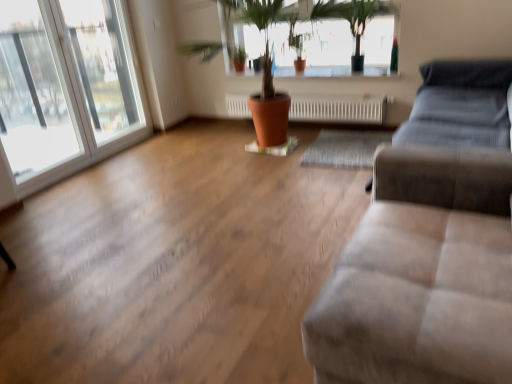
Question: Does transparent glass window at left, positioned as the second window in left-to-right order, come in front of transparent glass window at left, arranged as the 1th window when viewed from the left?

Choices:
 (A) yes
 (B) no

Answer: (B)

Question: Does transparent glass window at left, placed as the first window when sorted from right to left, have a greater height compared to transparent glass window at left, arranged as the 1th window when viewed from the left?

Choices:
 (A) yes
 (B) no

Answer: (B)

Question: Is transparent glass window at left, placed as the first window when sorted from right to left, not within transparent glass window at left, arranged as the 1th window when viewed from the left?

Choices:
 (A) yes
 (B) no

Answer: (B)

Question: Is transparent glass window at left, the 2th window viewed from the right, located within transparent glass window at left, placed as the first window when sorted from right to left?

Choices:
 (A) no
 (B) yes

Answer: (A)

Question: From the image's perspective, is transparent glass window at left, placed as the first window when sorted from right to left, on transparent glass window at left, the 2th window viewed from the right?

Choices:
 (A) no
 (B) yes

Answer: (B)

Question: Does point (56, 71) appear closer or farther from the camera than point (297, 57)?

Choices:
 (A) farther
 (B) closer

Answer: (B)

Question: Choose the correct answer: Is transparent glass window at left, arranged as the 1th window when viewed from the left, inside terracotta clay pot at center or outside it?

Choices:
 (A) inside
 (B) outside

Answer: (B)

Question: Visually, is transparent glass window at left, arranged as the 1th window when viewed from the left, positioned to the left or to the right of terracotta clay pot at center?

Choices:
 (A) right
 (B) left

Answer: (B)

Question: In terms of size, does transparent glass window at left, the 2th window viewed from the right, appear bigger or smaller than terracotta clay pot at center?

Choices:
 (A) big
 (B) small

Answer: (A)

Question: From their relative heights in the image, would you say suede-like beige couch at lower right is taller or shorter than transparent glass window at left, the 2th window viewed from the right?

Choices:
 (A) tall
 (B) short

Answer: (B)

Question: Relative to transparent glass window at left, arranged as the 1th window when viewed from the left, is suede-like beige couch at lower right in front or behind?

Choices:
 (A) front
 (B) behind

Answer: (A)

Question: Would you say suede-like beige couch at lower right is inside or outside transparent glass window at left, arranged as the 1th window when viewed from the left?

Choices:
 (A) outside
 (B) inside

Answer: (A)

Question: Is suede-like beige couch at lower right wider or thinner than transparent glass window at left, arranged as the 1th window when viewed from the left?

Choices:
 (A) thin
 (B) wide

Answer: (B)

Question: Does point (431, 168) appear closer or farther from the camera than point (361, 119)?

Choices:
 (A) closer
 (B) farther

Answer: (A)

Question: In terms of size, does suede-like beige couch at lower right appear bigger or smaller than white textured radiator at center?

Choices:
 (A) big
 (B) small

Answer: (A)